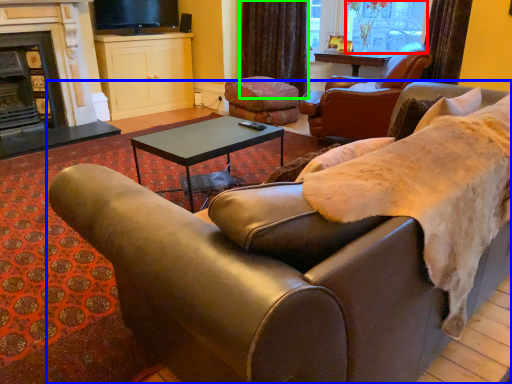
Question: Considering the real-world distances, which object is closest to window screen (highlighted by a red box)? studio couch (highlighted by a blue box) or curtain (highlighted by a green box).

Choices:
 (A) studio couch
 (B) curtain

Answer: (B)